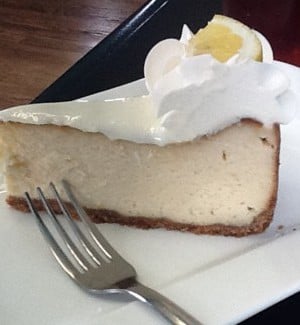
This screenshot has width=300, height=325. In order to click on fork in this screenshot , I will do `click(133, 289)`.